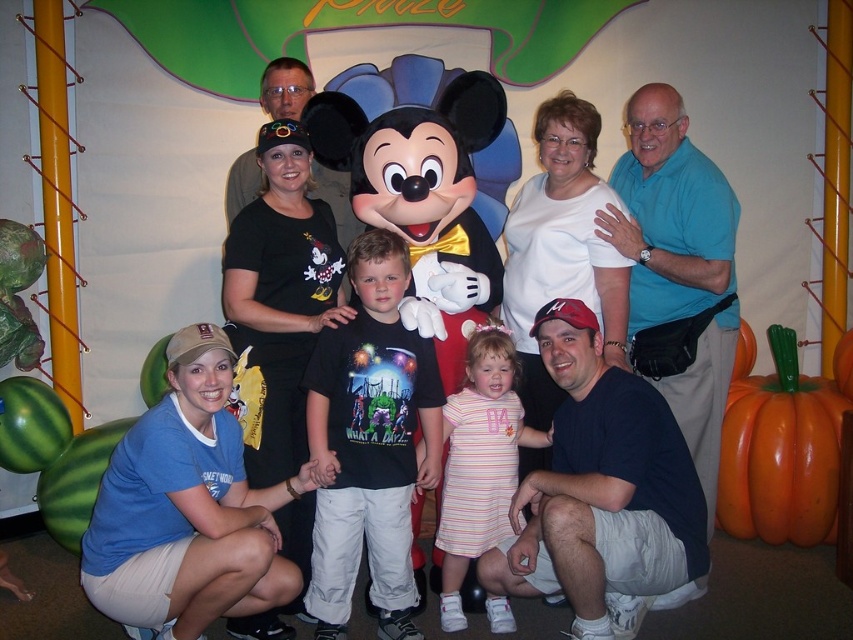
Question: Can you confirm if blue cotton t-shirt at lower left is thinner than striped cotton dress at center?

Choices:
 (A) yes
 (B) no

Answer: (B)

Question: Which of these objects is positioned farthest from the striped cotton dress at center?

Choices:
 (A) dark blue t-shirt at center
 (B) matte black t-shirt at center

Answer: (B)

Question: Which point appears closest to the camera in this image?

Choices:
 (A) (701, 372)
 (B) (434, 157)
 (C) (466, 468)
 (D) (245, 579)

Answer: (D)

Question: Can you confirm if matte black t-shirt at center is positioned below black cotton t-shirt at center?

Choices:
 (A) no
 (B) yes

Answer: (A)

Question: Which object is farther from the camera taking this photo?

Choices:
 (A) blue cotton t-shirt at lower left
 (B) striped cotton dress at center
 (C) dark blue t-shirt at center

Answer: (B)

Question: Is dark blue t-shirt at center to the right of blue cotton shirt at upper right from the viewer's perspective?

Choices:
 (A) no
 (B) yes

Answer: (A)